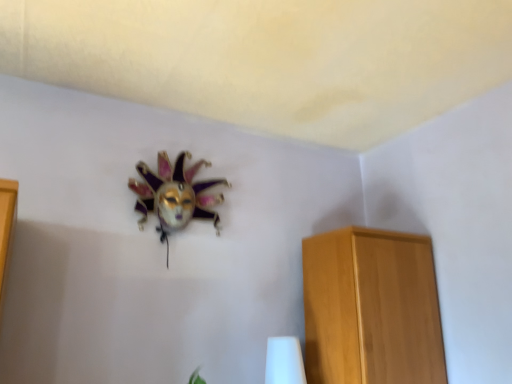
Question: Is metallic mask at upper center smaller than light brown wooden cabinet at right?

Choices:
 (A) no
 (B) yes

Answer: (B)

Question: From a real-world perspective, is metallic mask at upper center below light brown wooden cabinet at right?

Choices:
 (A) no
 (B) yes

Answer: (A)

Question: Considering the relative sizes of metallic mask at upper center and light brown wooden cabinet at right in the image provided, is metallic mask at upper center wider than light brown wooden cabinet at right?

Choices:
 (A) no
 (B) yes

Answer: (A)

Question: Is metallic mask at upper center oriented towards light brown wooden cabinet at right?

Choices:
 (A) yes
 (B) no

Answer: (B)

Question: Is light brown wooden cabinet at right inside metallic mask at upper center?

Choices:
 (A) no
 (B) yes

Answer: (A)

Question: Is metallic mask at upper center not near light brown wooden cabinet at right?

Choices:
 (A) yes
 (B) no

Answer: (B)

Question: From the image's perspective, would you say light brown wooden cabinet at right is positioned over metallic mask at upper center?

Choices:
 (A) no
 (B) yes

Answer: (A)

Question: Does light brown wooden cabinet at right have a larger size compared to metallic mask at upper center?

Choices:
 (A) no
 (B) yes

Answer: (B)

Question: Considering the relative sizes of light brown wooden cabinet at right and metallic mask at upper center in the image provided, is light brown wooden cabinet at right taller than metallic mask at upper center?

Choices:
 (A) yes
 (B) no

Answer: (A)

Question: Does light brown wooden cabinet at right have a lesser width compared to metallic mask at upper center?

Choices:
 (A) yes
 (B) no

Answer: (B)

Question: Does light brown wooden cabinet at right turn towards metallic mask at upper center?

Choices:
 (A) no
 (B) yes

Answer: (A)

Question: Can you confirm if light brown wooden cabinet at right is wider than metallic mask at upper center?

Choices:
 (A) no
 (B) yes

Answer: (B)

Question: Does white glossy table lamp at lower center have a lesser width compared to light brown wooden cabinet at right?

Choices:
 (A) yes
 (B) no

Answer: (A)